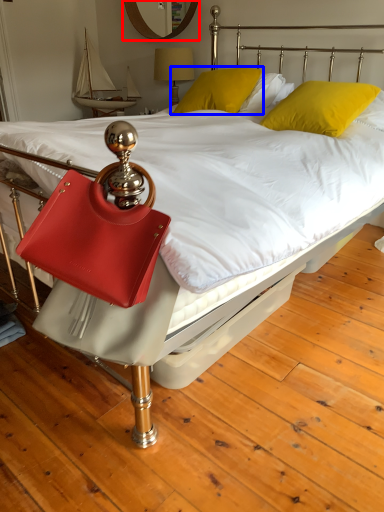
Question: Which point is further to the camera, mirror (highlighted by a red box) or pillow (highlighted by a blue box)?

Choices:
 (A) mirror
 (B) pillow

Answer: (A)